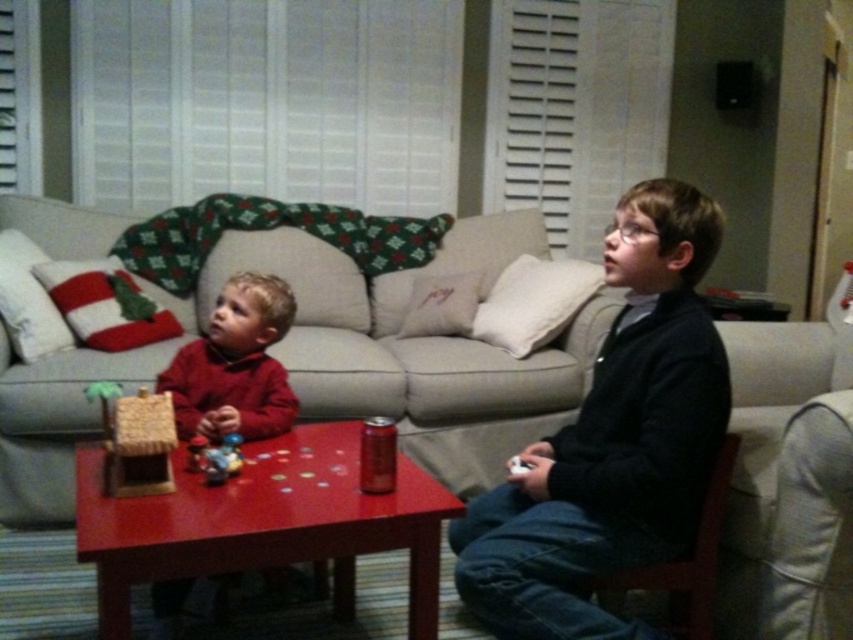
Question: Which point is farther to the camera?

Choices:
 (A) (193, 449)
 (B) (282, 419)
 (C) (323, 406)
 (D) (683, 445)

Answer: (C)

Question: Which of the following is the closest to the observer?

Choices:
 (A) matte red sweater at left
 (B) matte red sweater at center
 (C) smooth wooden table at center

Answer: (C)

Question: Observing the image, what is the correct spatial positioning of beige fabric couch at center in reference to matte red sweater at center?

Choices:
 (A) left
 (B) right

Answer: (B)

Question: Is beige fabric couch at center further to camera compared to matte red sweater at left?

Choices:
 (A) yes
 (B) no

Answer: (A)

Question: Considering the real-world distances, which object is farthest from the black sweater at right?

Choices:
 (A) matte red sweater at left
 (B) beige fabric couch at center
 (C) dark fabric armchair at lower right

Answer: (B)

Question: Is black sweater at right above matte red sweater at center?

Choices:
 (A) yes
 (B) no

Answer: (B)